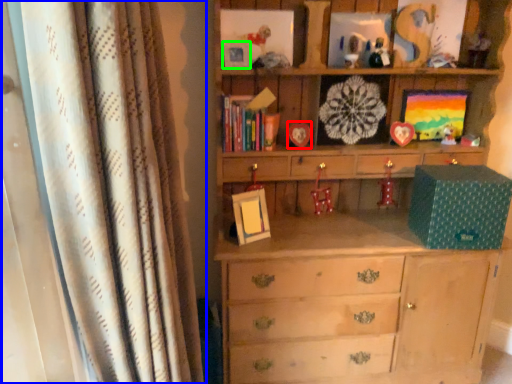
Question: Considering the real-world distances, which object is farthest from picture frame (highlighted by a red box)? curtain (highlighted by a blue box) or picture frame (highlighted by a green box)?

Choices:
 (A) curtain
 (B) picture frame

Answer: (A)